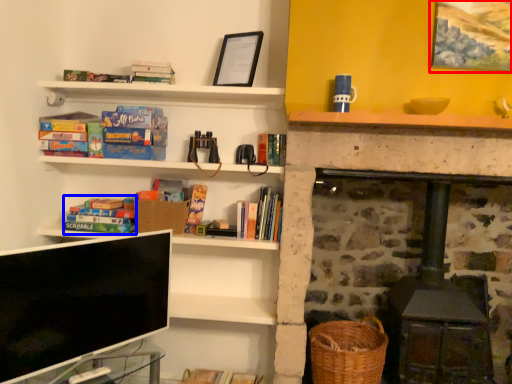
Question: Which point is closer to the camera, picture frame (highlighted by a red box) or book (highlighted by a blue box)?

Choices:
 (A) picture frame
 (B) book

Answer: (A)